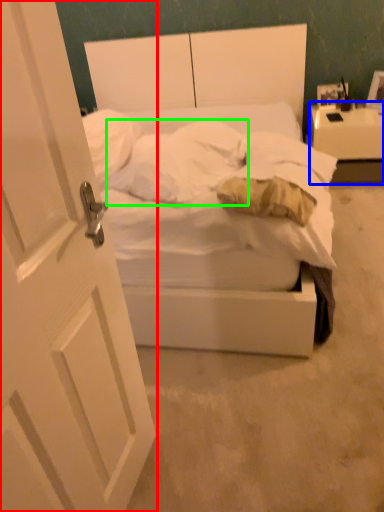
Question: Considering the real-world distances, which object is closest to door (highlighted by a red box)? nightstand (highlighted by a blue box) or pillow (highlighted by a green box).

Choices:
 (A) nightstand
 (B) pillow

Answer: (B)